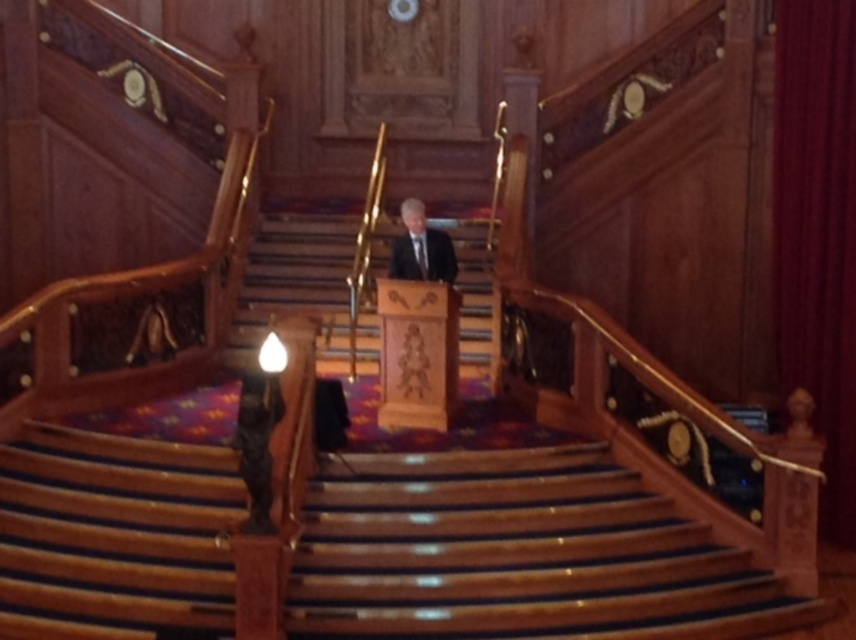
You are an event planner setting up a stage for a presentation. You need to ensure that the wooden podium at center is visible to all attendees seated below the grand staircase. Considering the dark red velvet curtain at upper center, will the podium be obscured by the curtain?

The dark red velvet curtain at upper center is much taller than the wooden podium at center, so the podium may be partially or fully obscured by the curtain depending on their positioning. However, since the curtain is at the upper center and the podium is at the center, it might be positioned in front of the curtain, making it visible. Further details about their exact arrangement are needed to determine visibility.

You are attending a formal event in this grand staircase area. You need to move from the bottom of the stairs to the speaker at the top. There is a wooden podium at center and a dark suit at center in your path. Which object should you avoid stepping on to reach the speaker?

The wooden podium at center is to the left of dark suit at center, so you should avoid stepping on the wooden podium at center and proceed towards the dark suit at center to reach the speaker.